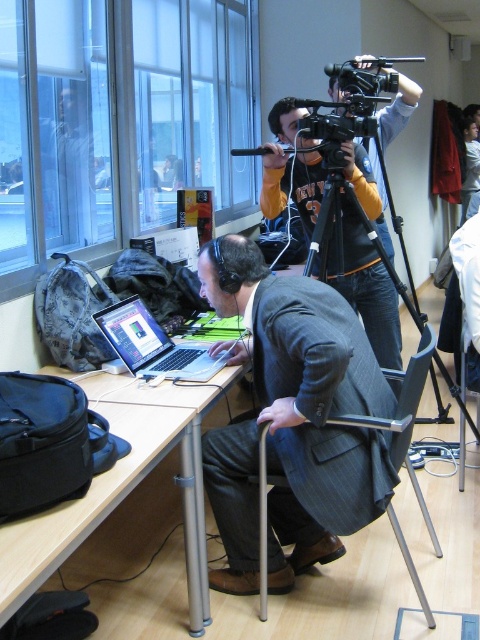
Consider the image. Which of these two, silver metallic table at center or black matte tripod at center, stands shorter?

Standing shorter between the two is black matte tripod at center.

Is point (171, 406) positioned before point (374, 141)?

Yes, it is in front of point (374, 141).

What are the coordinates of `silver metallic table at center` in the screenshot? It's located at (122, 484).

Can you confirm if metallic gray chair at center is smaller than satin black laptop at center?

Incorrect, metallic gray chair at center is not smaller in size than satin black laptop at center.

Which is behind, point (266, 497) or point (151, 376)?

Point (151, 376)

The height and width of the screenshot is (640, 480). What do you see at coordinates (403, 419) in the screenshot?
I see `metallic gray chair at center` at bounding box center [403, 419].

Identify the location of metallic gray chair at center. (403, 419).

Describe the element at coordinates (291, 420) in the screenshot. This screenshot has width=480, height=640. I see `dark gray pinstripe suit at center` at that location.

Is dark gray pinstripe suit at center closer to camera compared to black matte tripod at center?

Yes.

Measure the distance between point (269, 465) and camera.

Point (269, 465) is 6.68 feet from camera.

Find the location of a particular element. The image size is (480, 640). dark gray pinstripe suit at center is located at coordinates tap(291, 420).